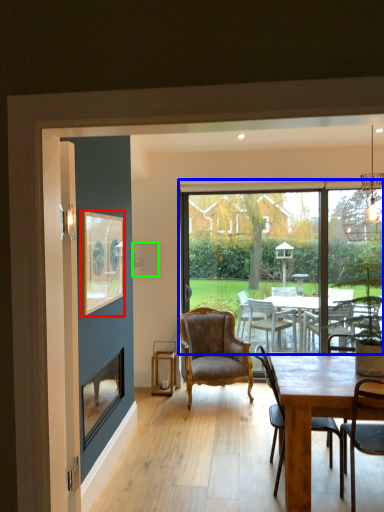
Question: Based on their relative distances, which object is farther from picture frame (highlighted by a red box)? Choose from window (highlighted by a blue box) and picture frame (highlighted by a green box).

Choices:
 (A) window
 (B) picture frame

Answer: (A)